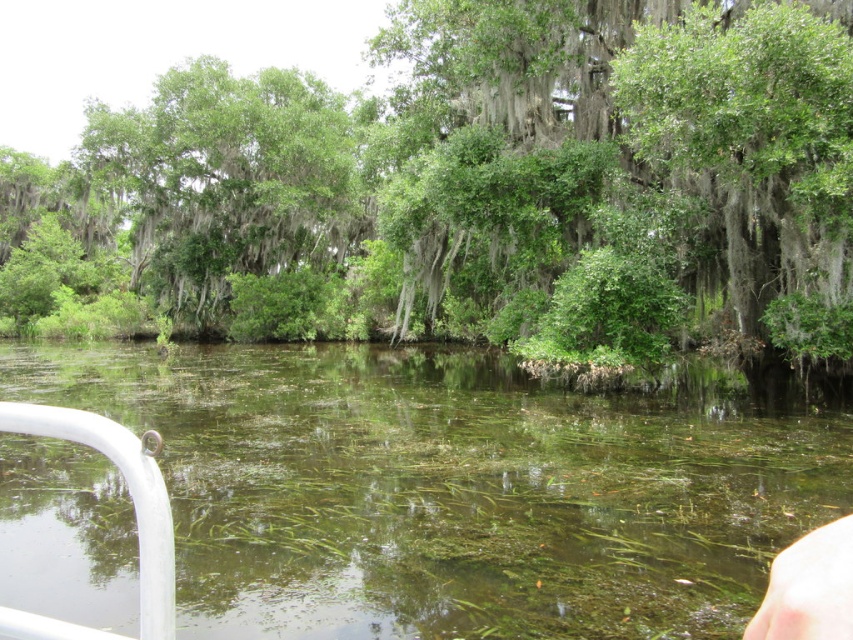
Question: Can you confirm if white metallic rail at lower left is bigger than skinny white hand at lower right?

Choices:
 (A) no
 (B) yes

Answer: (B)

Question: Among these objects, which one is farthest from the camera?

Choices:
 (A) green leafy tree at center
 (B) skinny white hand at lower right
 (C) clear water at lower center

Answer: (A)

Question: Does white metallic rail at lower left have a lesser width compared to skinny white hand at lower right?

Choices:
 (A) yes
 (B) no

Answer: (B)

Question: Which point is farther to the camera?

Choices:
 (A) skinny white hand at lower right
 (B) clear water at lower center

Answer: (B)

Question: Can you confirm if clear water at lower center is positioned to the left of skinny white hand at lower right?

Choices:
 (A) no
 (B) yes

Answer: (B)

Question: Among these objects, which one is nearest to the camera?

Choices:
 (A) skinny white hand at lower right
 (B) clear water at lower center
 (C) green leafy tree at center
 (D) white metallic rail at lower left

Answer: (A)